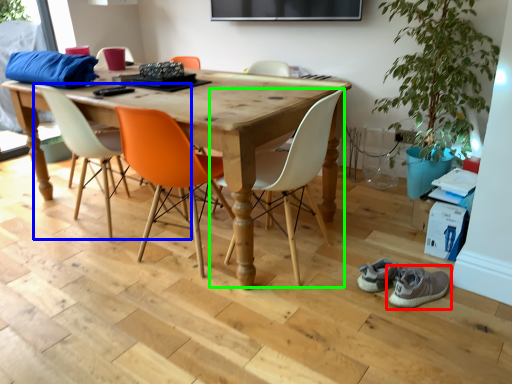
Question: Which object is the farthest from footwear (highlighted by a red box)? Choose among these: chair (highlighted by a blue box) or chair (highlighted by a green box).

Choices:
 (A) chair
 (B) chair

Answer: (A)